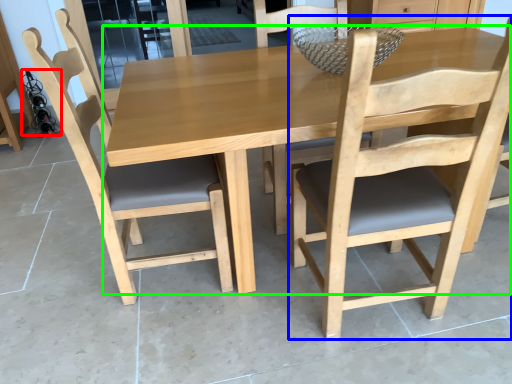
Question: Which object is the farthest from wine bottle (highlighted by a red box)? Choose among these: chair (highlighted by a blue box) or kitchen & dining room table (highlighted by a green box).

Choices:
 (A) chair
 (B) kitchen & dining room table

Answer: (A)